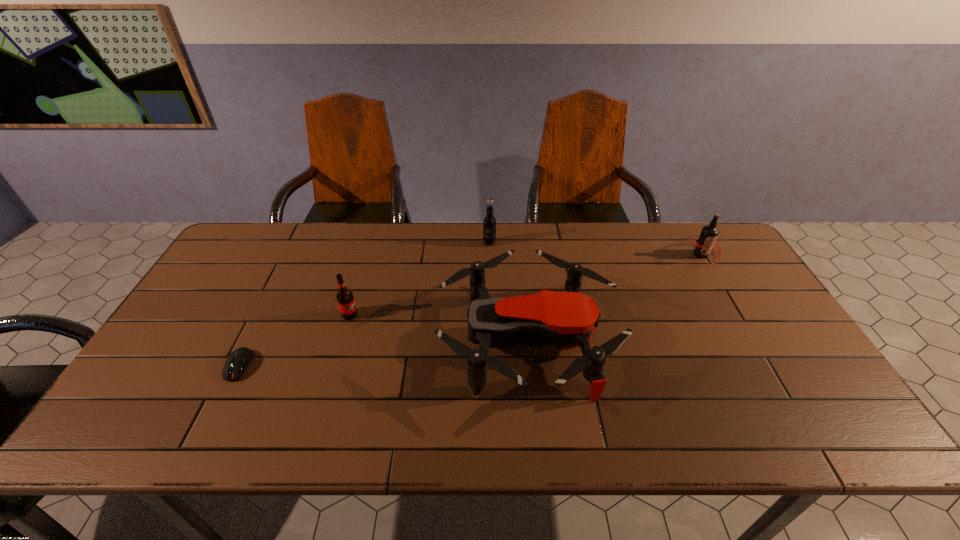
In order to click on object that is the third closest to the second root beer from right to left in this screenshot , I will do click(x=706, y=241).

I want to click on the second closest object to the drone, so click(x=345, y=299).

Where is `the second closest root beer to the computer equipment`? the second closest root beer to the computer equipment is located at coordinates (489, 223).

The height and width of the screenshot is (540, 960). What are the coordinates of `root beer object that ranks as the second closest to the rightmost root beer` in the screenshot? It's located at (345, 299).

Locate an element on the screen. Image resolution: width=960 pixels, height=540 pixels. vacant space that satisfies the following two spatial constraints: 1. on the label of the rightmost root beer; 2. on the camera side of the drone is located at coordinates (753, 342).

Identify the location of free spot that satisfies the following two spatial constraints: 1. on the camera side of the drone; 2. on the button of the shortest object. This screenshot has width=960, height=540. (529, 366).